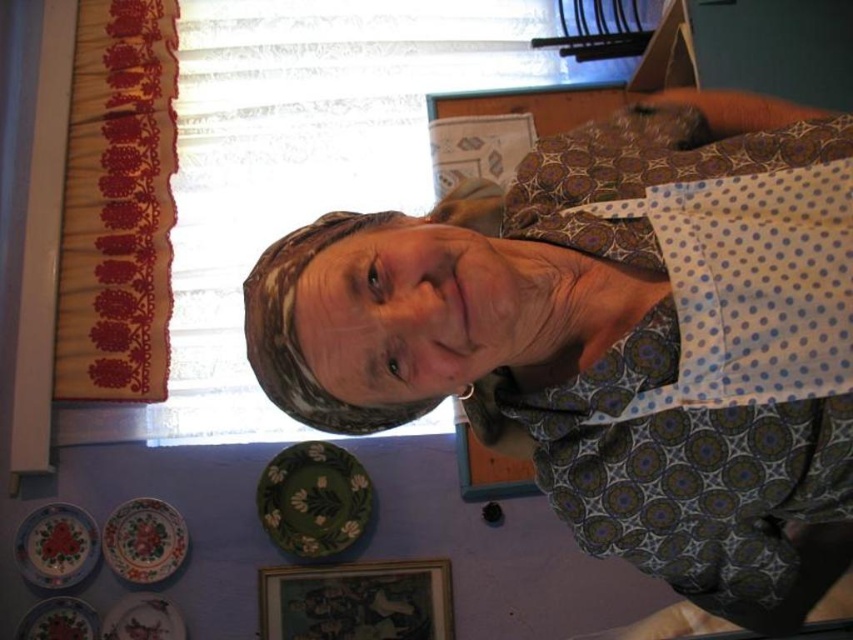
Who is more distant from viewer, [73,525] or [42,612]?

The point [73,525] is more distant.

Is matte ceramic plate at lower left further to camera compared to white glossy plate at lower left?

Yes, matte ceramic plate at lower left is further from the viewer.

Is point (30, 545) positioned behind point (73, 598)?

Yes.

The image size is (853, 640). I want to click on matte ceramic plate at lower left, so click(56, 545).

Who is shorter, green matte plate at lower left or matte ceramic plate at lower left?

matte ceramic plate at lower left

At what (x,y) coordinates should I click in order to perform the action: click on green matte plate at lower left. Please return your answer as a coordinate pair (x, y). Image resolution: width=853 pixels, height=640 pixels. Looking at the image, I should click on (314, 499).

Where is `polka dot fabric at upper center`? The image size is (853, 640). polka dot fabric at upper center is located at coordinates (618, 342).

Does polka dot fabric at upper center have a lesser width compared to green glazed plate at lower left?

No, polka dot fabric at upper center is not thinner than green glazed plate at lower left.

Is point (305, 416) more distant than point (134, 618)?

No, it is in front of (134, 618).

The height and width of the screenshot is (640, 853). Identify the location of polka dot fabric at upper center. (618, 342).